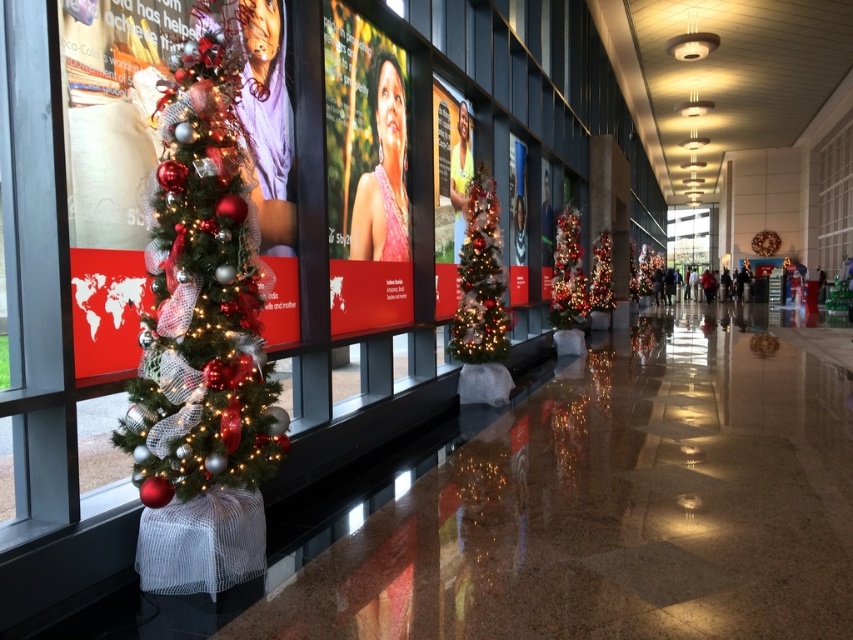
Between shiny red and silver christmas tree at left and shiny silver tinsel at center, which one is positioned lower?

shiny red and silver christmas tree at left

Is shiny red and silver christmas tree at left to the left of shiny silver tinsel at center from the viewer's perspective?

Yes, shiny red and silver christmas tree at left is to the left of shiny silver tinsel at center.

The height and width of the screenshot is (640, 853). Describe the element at coordinates (202, 292) in the screenshot. I see `shiny red and silver christmas tree at left` at that location.

Locate an element on the screen. shiny red and silver christmas tree at left is located at coordinates (202, 292).

Does point (135, 394) lie behind point (496, 216)?

No, (135, 394) is in front of (496, 216).

Between point (256, 266) and point (483, 189), which one is positioned in front?

Positioned in front is point (256, 266).

The image size is (853, 640). I want to click on shiny red and silver christmas tree at left, so click(202, 292).

Does shiny silver christmas tree at center have a larger size compared to shiny silver tinsel at center?

No, shiny silver christmas tree at center is not bigger than shiny silver tinsel at center.

Is the position of shiny silver christmas tree at center less distant than that of shiny silver tinsel at center?

Yes, shiny silver christmas tree at center is in front of shiny silver tinsel at center.

Does point (465, 348) lie behind point (569, 257)?

No, it is not.

This screenshot has width=853, height=640. I want to click on shiny silver christmas tree at center, so click(480, 280).